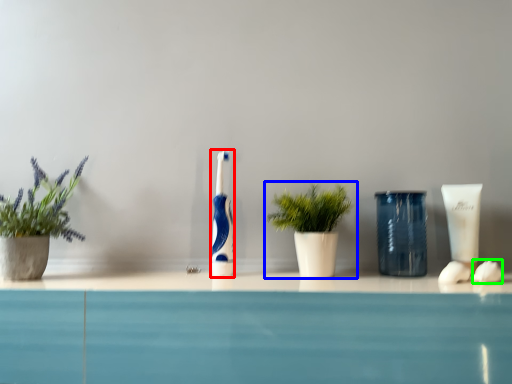
Question: Which object is the closest to the toothbrush (highlighted by a red box)? Choose among these: houseplant (highlighted by a blue box) or soap (highlighted by a green box).

Choices:
 (A) houseplant
 (B) soap

Answer: (A)